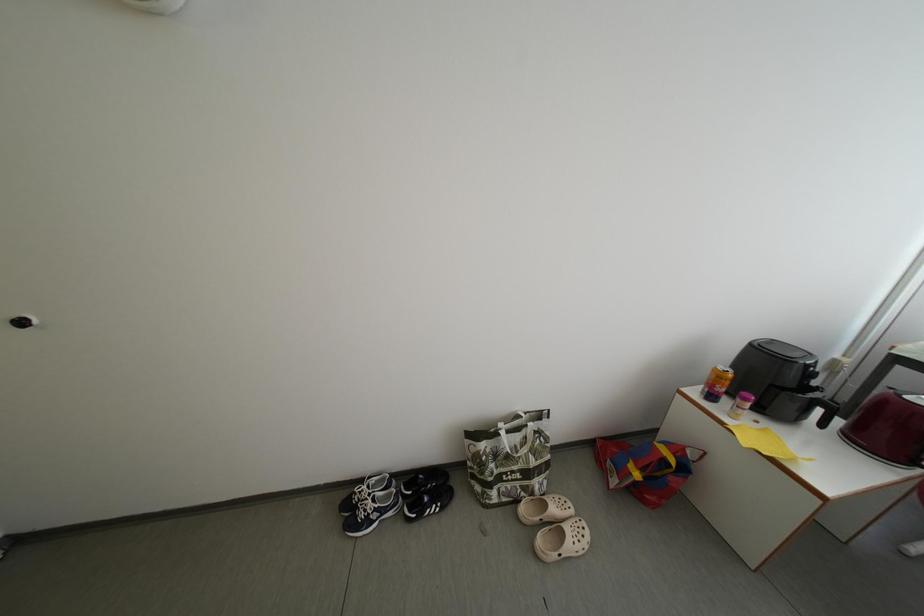
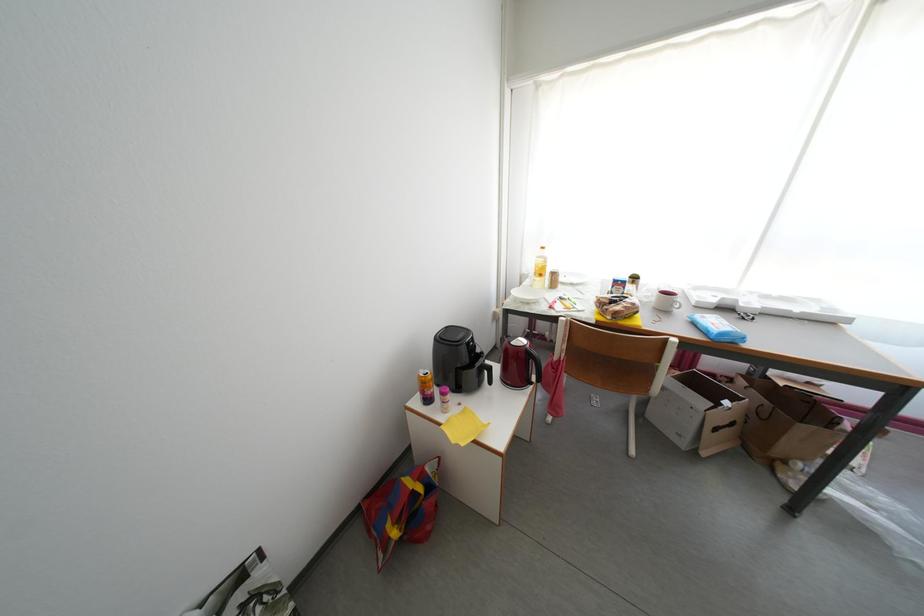
Question: The camera is either moving clockwise (left) or counter-clockwise (right) around the object. The first image is from the beginning of the video and the second image is from the end. Is the camera moving left or right when shooting the video?

Choices:
 (A) Left
 (B) Right

Answer: (A)